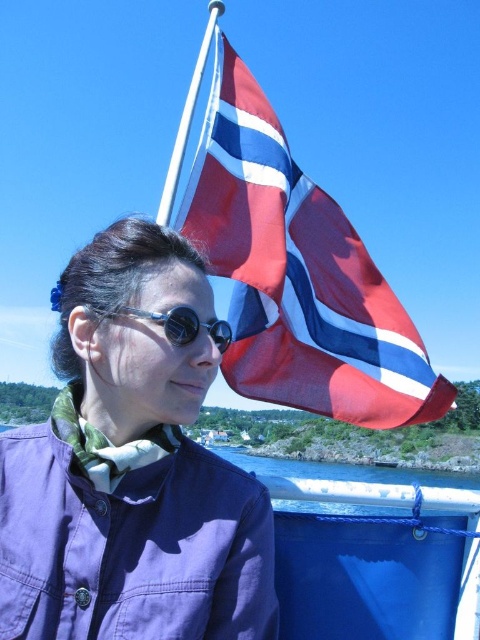
Between purple fabric jacket at upper left and red and white striped flag at upper right, which one is positioned higher?

purple fabric jacket at upper left is above.

You are a GUI agent. You are given a task and a screenshot of the screen. Output one action in this format:
    pyautogui.click(x=<x>, y=<y>)
    Task: Click on the purple fabric jacket at upper left
    The height and width of the screenshot is (640, 480).
    Given the screenshot: What is the action you would take?
    pyautogui.click(x=132, y=465)

Who is more distant from viewer, (21,534) or (269,358)?

Point (269,358)

Locate an element on the screen. purple fabric jacket at upper left is located at coordinates (132, 465).

How much distance is there between purple fabric jacket at upper left and black matte goggles at center?

They are 11.63 inches apart.

Does point (64, 464) lie behind point (143, 314)?

No, it is not.

Which is in front, point (128, 282) or point (189, 337)?

Point (128, 282) is in front.

The image size is (480, 640). I want to click on purple fabric jacket at upper left, so click(x=132, y=465).

Looking at this image, which of these two, red and white striped flag at upper right or black matte goggles at center, stands taller?

red and white striped flag at upper right

Which is in front, point (316, 253) or point (192, 336)?

Point (192, 336)

Does point (323, 257) lie in front of point (217, 332)?

That is False.

At what (x,y) coordinates should I click in order to perform the action: click on red and white striped flag at upper right. Please return your answer as a coordinate pair (x, y). Looking at the image, I should click on (298, 275).